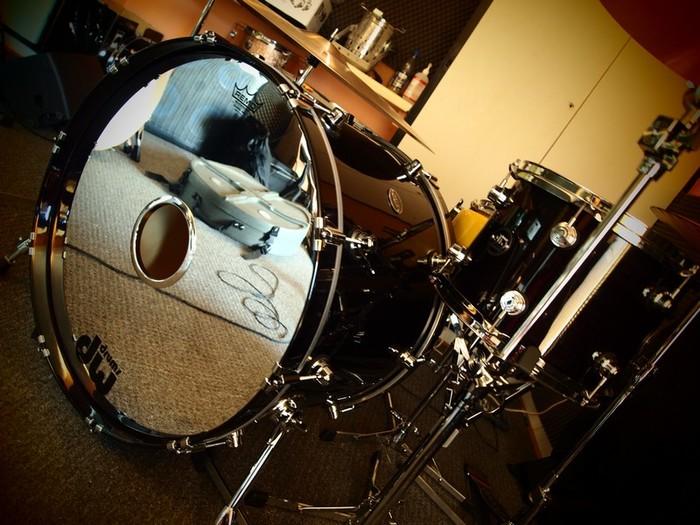
The height and width of the screenshot is (525, 700). What are the coordinates of `bottle` in the screenshot? It's located at (416, 82).